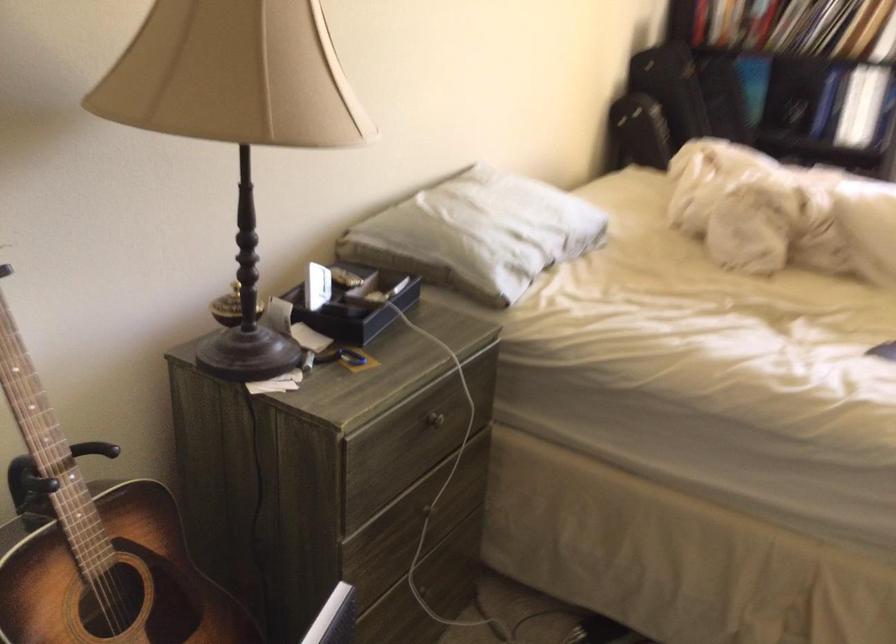
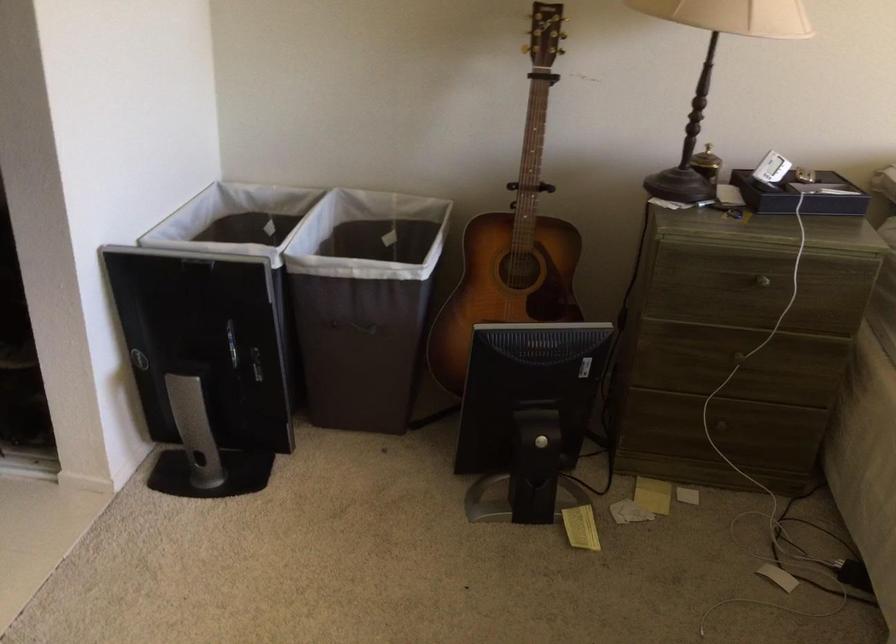
In the second image, find the point that corresponds to (x=80, y=562) in the first image.

(513, 237)